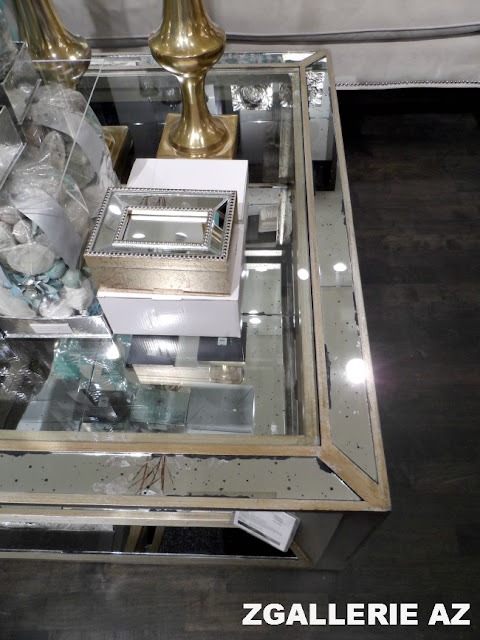
At what (x,y) coordinates should I click in order to perform the action: click on display case border. Please return your answer as a coordinate pair (x, y). Image resolution: width=480 pixels, height=640 pixels. Looking at the image, I should click on (218, 484), (344, 315), (240, 54).